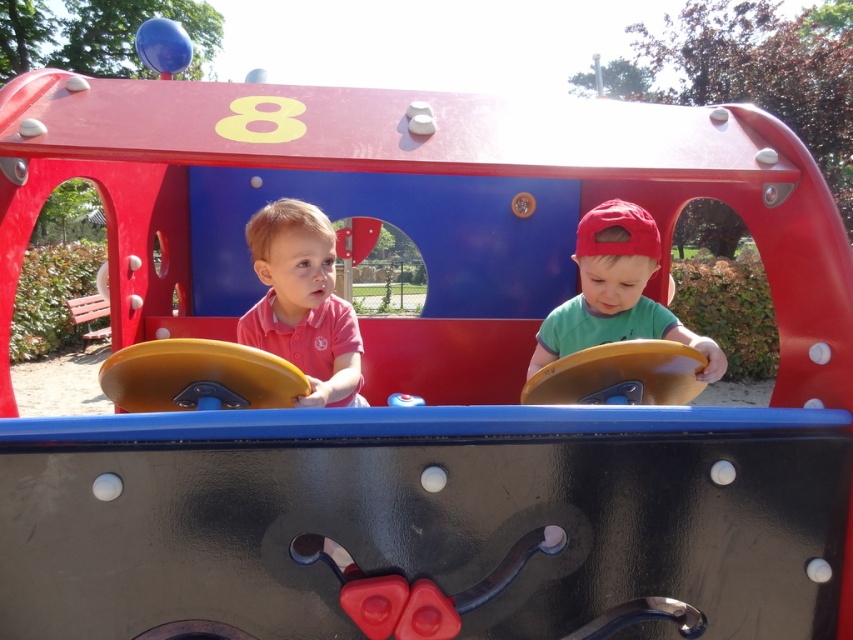
Question: Which object appears closest to the camera in this image?

Choices:
 (A) matte pink shirt at center
 (B) green matte shirt at center

Answer: (A)

Question: Is matte pink shirt at center below green matte shirt at center?

Choices:
 (A) no
 (B) yes

Answer: (B)

Question: Among these points, which one is nearest to the camera?

Choices:
 (A) (608, 266)
 (B) (310, 340)

Answer: (A)

Question: Is matte pink shirt at center positioned behind green matte shirt at center?

Choices:
 (A) yes
 (B) no

Answer: (B)

Question: Does matte pink shirt at center lie behind green matte shirt at center?

Choices:
 (A) no
 (B) yes

Answer: (A)